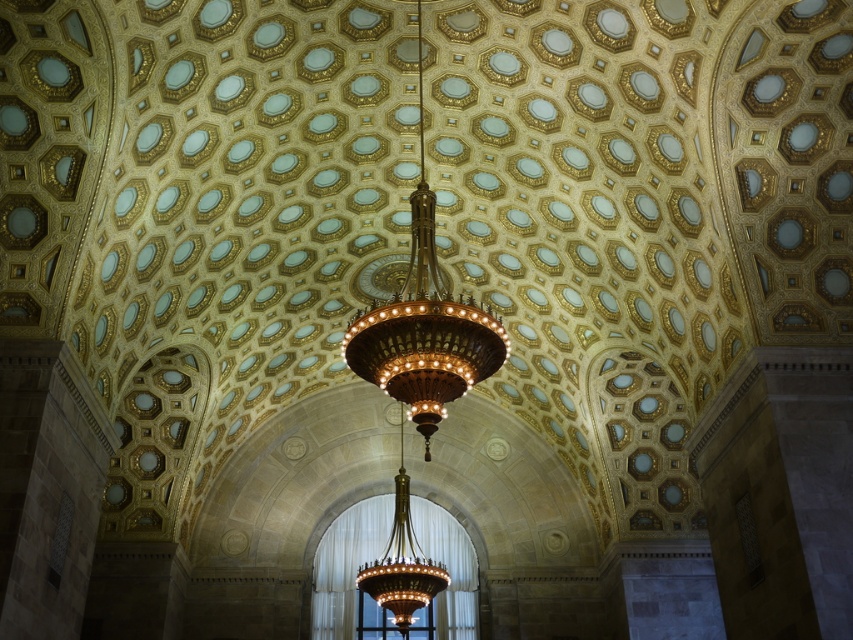
Is point (412, 330) more distant than point (401, 547)?

No, it is not.

Who is more forward, [485,349] or [393,520]?

Point [485,349] is in front.

The image size is (853, 640). I want to click on polished brass chandelier at center, so click(x=424, y=323).